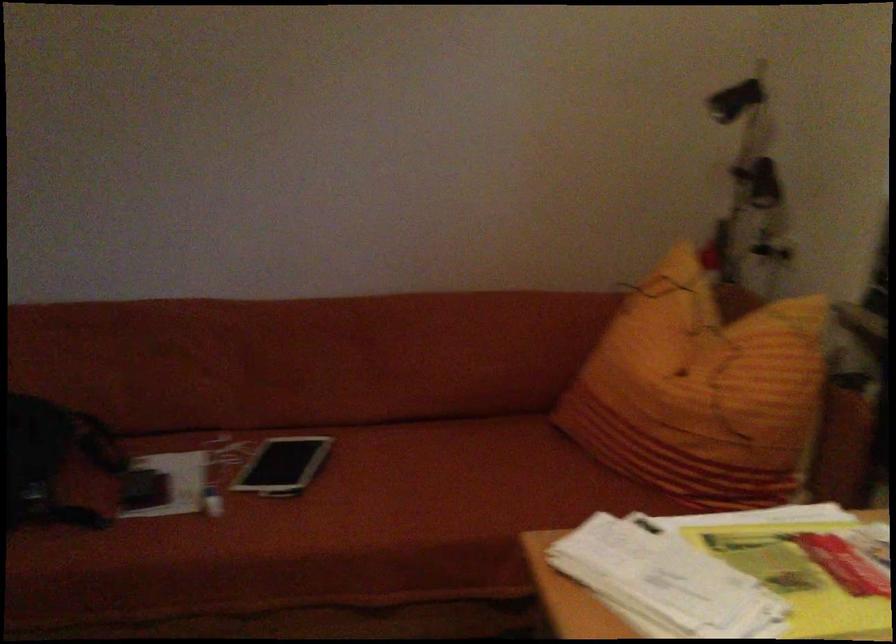
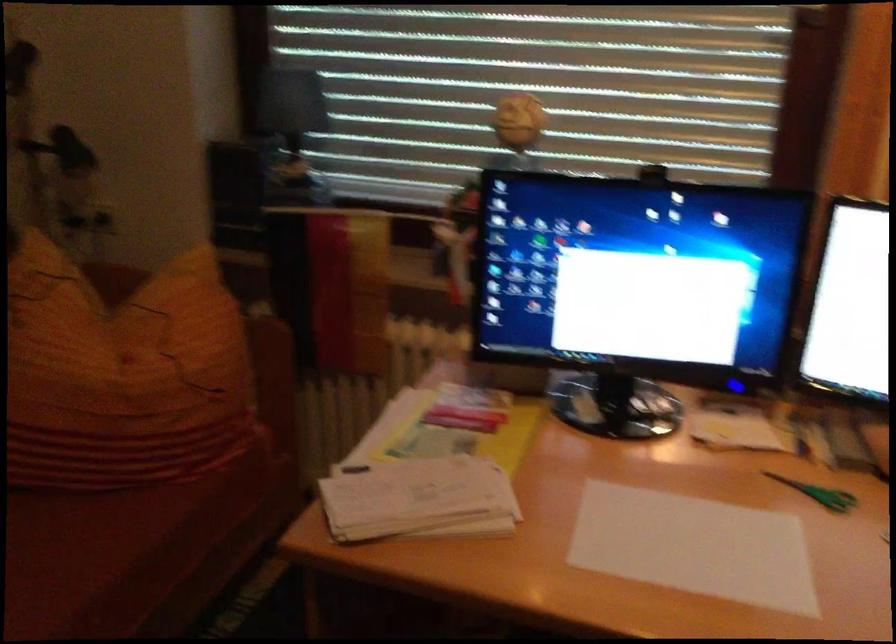
Where in the second image is the point corresponding to pixel 553 495 from the first image?

(66, 556)